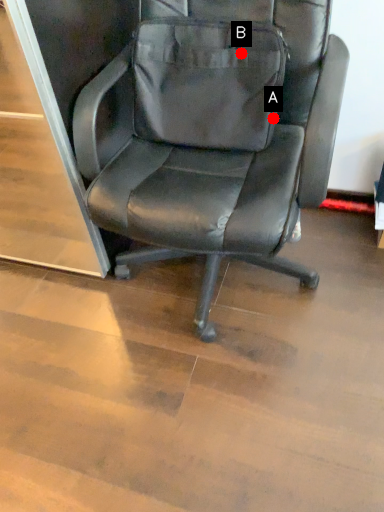
Question: Two points are circled on the image, labeled by A and B beside each circle. Which of the following is the farthest from the observer?

Choices:
 (A) A is further
 (B) B is further

Answer: (A)